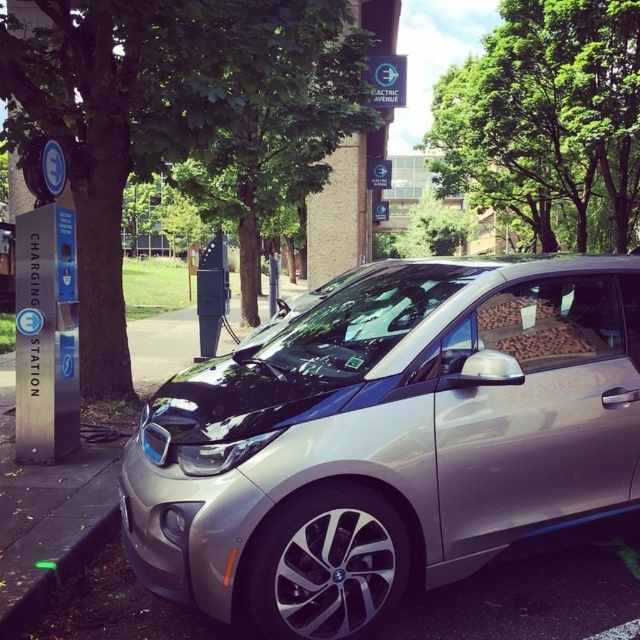
Which is above, sleek metallic car at center or green leafy tree at upper center?

Positioned higher is green leafy tree at upper center.

Does sleek metallic car at center have a greater height compared to green leafy tree at upper center?

Yes, sleek metallic car at center is taller than green leafy tree at upper center.

In order to click on sleek metallic car at center in this screenshot , I will do `click(388, 440)`.

Between sleek metallic car at center and green leafy tree at center, which one appears on the left side from the viewer's perspective?

Positioned to the left is sleek metallic car at center.

Does sleek metallic car at center have a lesser width compared to green leafy tree at center?

Correct, sleek metallic car at center's width is less than green leafy tree at center's.

Describe the element at coordinates (388, 440) in the screenshot. I see `sleek metallic car at center` at that location.

Image resolution: width=640 pixels, height=640 pixels. I want to click on sleek metallic car at center, so click(388, 440).

Which of these two, green leafy tree at upper center or green rubber curb at lower left, stands taller?

green leafy tree at upper center is taller.

Does green leafy tree at upper center have a larger size compared to green rubber curb at lower left?

No.

The height and width of the screenshot is (640, 640). What do you see at coordinates (170, 113) in the screenshot?
I see `green leafy tree at upper center` at bounding box center [170, 113].

You are a GUI agent. You are given a task and a screenshot of the screen. Output one action in this format:
    pyautogui.click(x=<x>, y=<y>)
    Task: Click on the green leafy tree at upper center
    Image resolution: width=640 pixels, height=640 pixels.
    Given the screenshot: What is the action you would take?
    pyautogui.click(x=170, y=113)